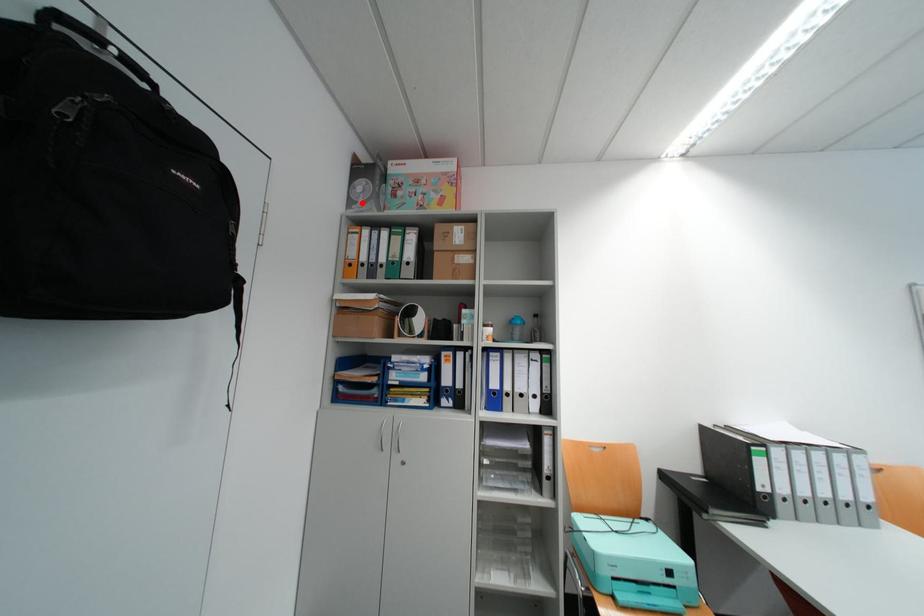
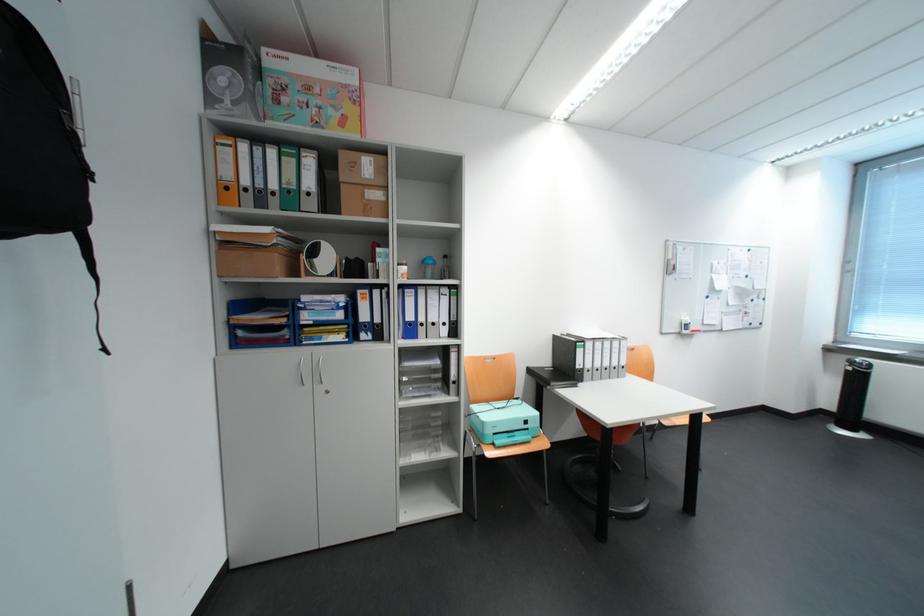
The point at the highlighted location is marked in the first image. Where is the corresponding point in the second image?

(223, 99)